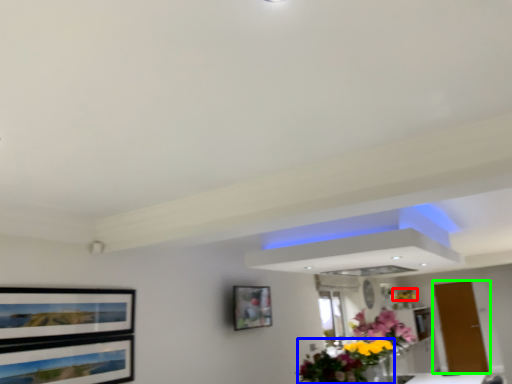
Question: Which object is positioned closest to flower (highlighted by a red box)? Select from floral arrangement (highlighted by a blue box) and door (highlighted by a green box).

Choices:
 (A) floral arrangement
 (B) door

Answer: (B)